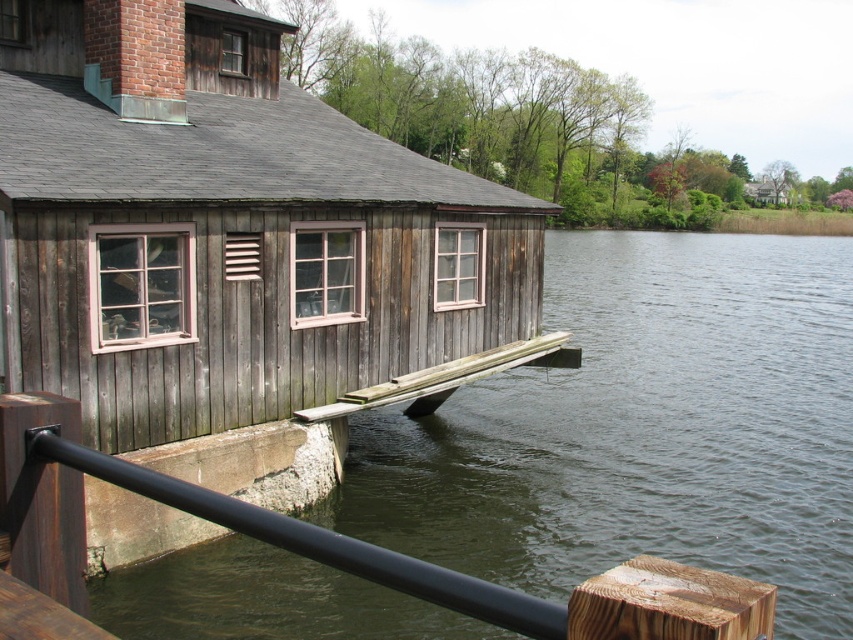
Does weathered wood cabin at center have a greater width compared to weathered wood dock at lower center?

Correct, the width of weathered wood cabin at center exceeds that of weathered wood dock at lower center.

Does point (299, 163) come behind point (376, 406)?

Yes, point (299, 163) is behind point (376, 406).

Does point (138, 337) come behind point (322, 419)?

No, it is not.

This screenshot has width=853, height=640. Identify the location of weathered wood cabin at center. (228, 228).

Is point (390, 321) more distant than point (538, 609)?

That is True.

Who is positioned more to the right, weathered wood cabin at center or black metal/rail at lower left?

Positioned to the right is black metal/rail at lower left.

Does point (144, 17) come farther from viewer compared to point (50, 448)?

That is True.

Find the location of a particular element. This screenshot has width=853, height=640. weathered wood cabin at center is located at coordinates (228, 228).

Does black metal/rail at lower left have a lesser height compared to weathered wood dock at lower center?

Correct, black metal/rail at lower left is not as tall as weathered wood dock at lower center.

Is point (444, 579) closer to camera compared to point (548, 358)?

Yes, it is in front of point (548, 358).

Is point (193, 500) behind point (369, 388)?

That is False.

Locate an element on the screen. black metal/rail at lower left is located at coordinates (x=312, y=540).